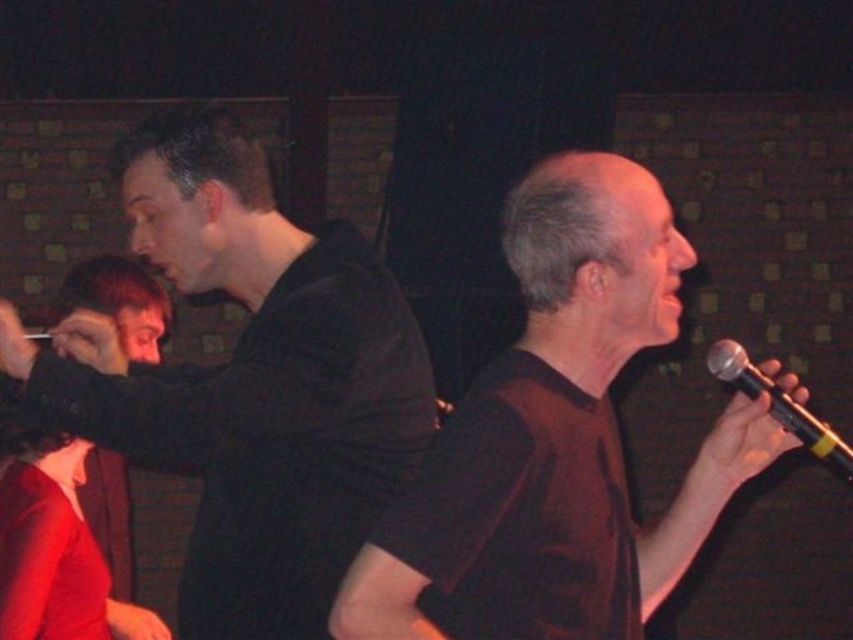
Does brown matte shirt at right appear under black metallic microphone at right?

No, brown matte shirt at right is not below black metallic microphone at right.

Between brown matte shirt at right and black metallic microphone at right, which one appears on the right side from the viewer's perspective?

Positioned to the right is black metallic microphone at right.

Which is behind, point (641, 285) or point (807, 413)?

The point (807, 413) is behind.

At what (x,y) coordinates should I click in order to perform the action: click on brown matte shirt at right. Please return your answer as a coordinate pair (x, y). The width and height of the screenshot is (853, 640). Looking at the image, I should click on (532, 369).

Who is higher up, black matte shirt at left or black metallic microphone at right?

black matte shirt at left is above.

Which is in front, point (366, 413) or point (757, 387)?

Positioned in front is point (366, 413).

Find the location of a particular element. The image size is (853, 640). black matte shirt at left is located at coordinates (251, 380).

Who is more distant from viewer, (97, 413) or (625, 273)?

The point (97, 413) is behind.

Who is more forward, (302, 296) or (750, 449)?

Point (302, 296) is more forward.

Describe the element at coordinates (251, 380) in the screenshot. This screenshot has height=640, width=853. I see `black matte shirt at left` at that location.

Locate an element on the screen. black matte shirt at left is located at coordinates (251, 380).